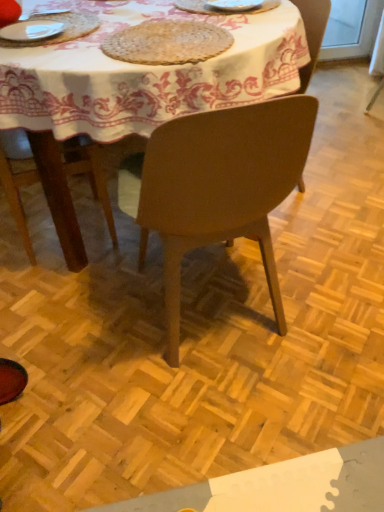
The height and width of the screenshot is (512, 384). Find the location of `spots to the right of matte brown chair at center, which ranks as the 2th chair in back-to-front order`. spots to the right of matte brown chair at center, which ranks as the 2th chair in back-to-front order is located at coordinates (326, 286).